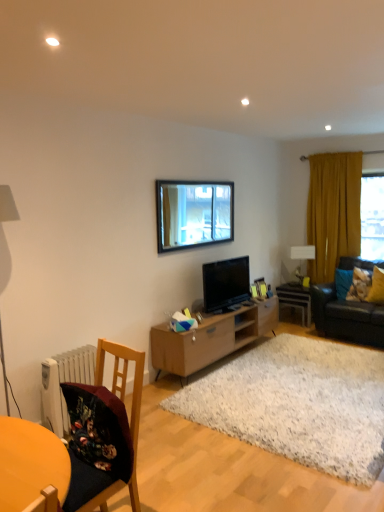
Identify the location of vacant area on top of white shaggy rug at center (from a real-world perspective). The image size is (384, 512). [308, 381].